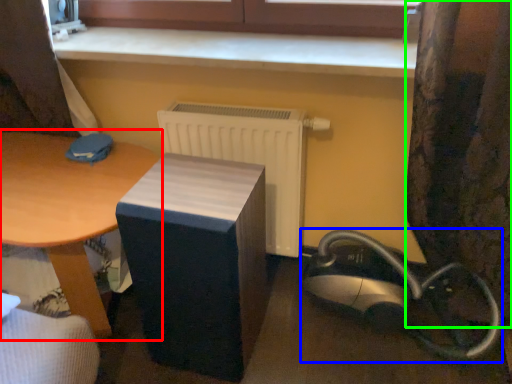
Question: Which object is positioned farthest from table (highlighted by a red box)? Select from equipment (highlighted by a blue box) and curtain (highlighted by a green box).

Choices:
 (A) equipment
 (B) curtain

Answer: (B)